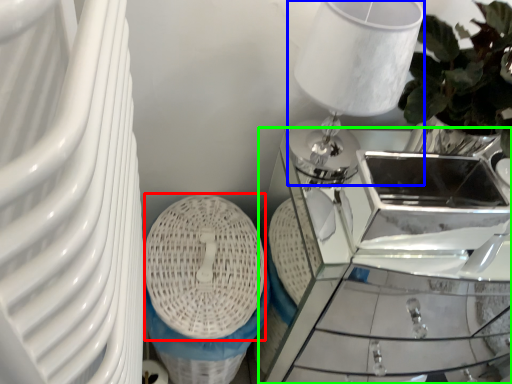
Question: Estimate the real-world distances between objects in this image. Which object is closer to basket (highlighted by a red box), table lamp (highlighted by a blue box) or table (highlighted by a green box)?

Choices:
 (A) table lamp
 (B) table

Answer: (A)